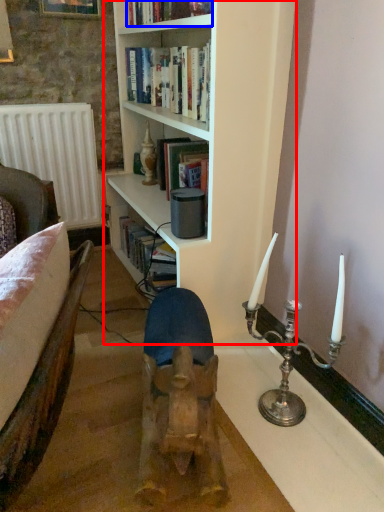
Question: Which point is closer to the camera, bookcase (highlighted by a red box) or book (highlighted by a blue box)?

Choices:
 (A) bookcase
 (B) book

Answer: (A)